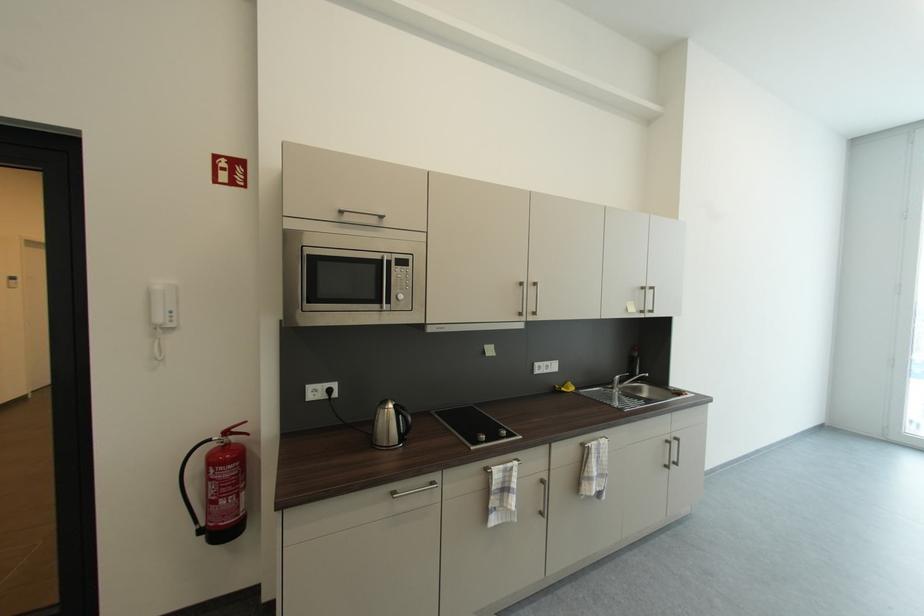
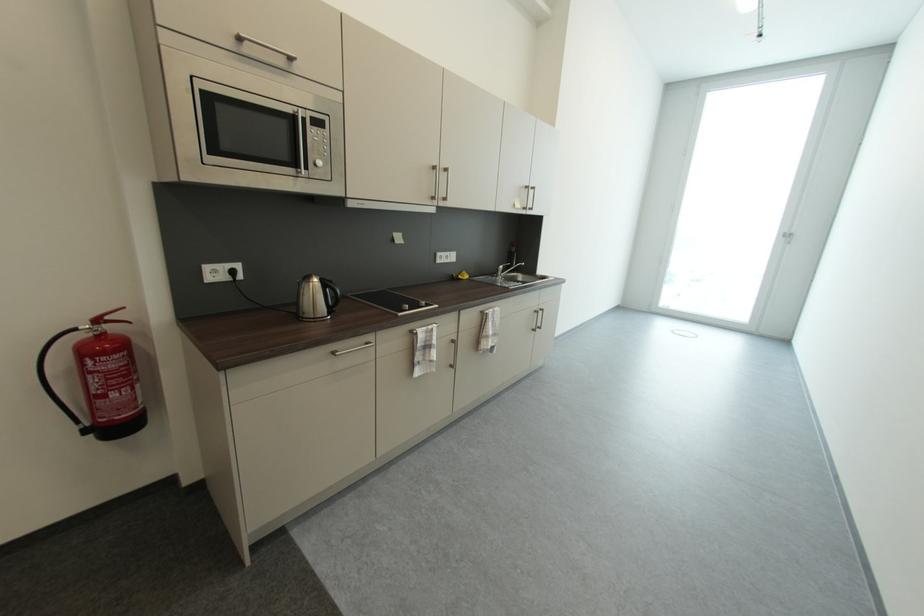
Find the pixel in the second image that matches point (239, 431) in the first image.

(116, 318)